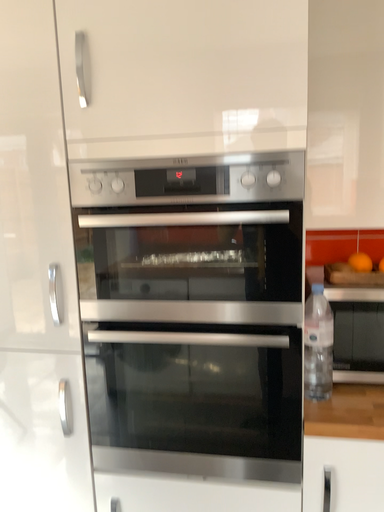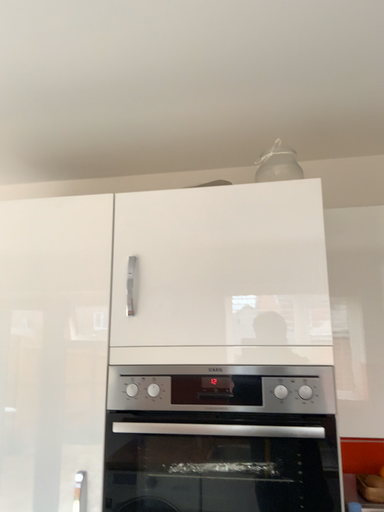
Question: How did the camera likely rotate when shooting the video?

Choices:
 (A) rotated downward
 (B) rotated upward

Answer: (B)